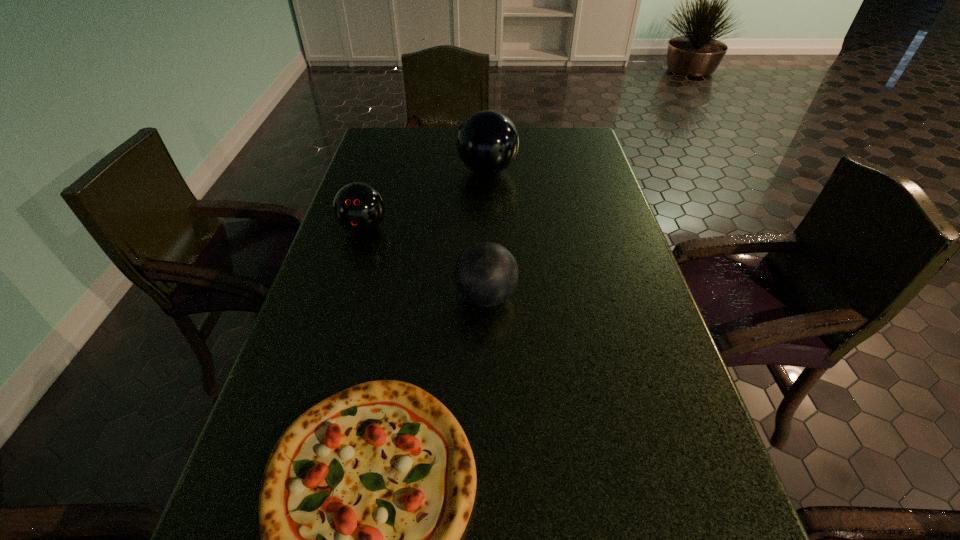
Find the location of a particular element. This screenshot has width=960, height=540. vacant area that lies between the second nearest object and the leftmost bowling ball is located at coordinates (425, 262).

Where is `free space between the third farthest object and the farthest object`? The width and height of the screenshot is (960, 540). free space between the third farthest object and the farthest object is located at coordinates (487, 234).

The image size is (960, 540). Identify the location of object that stands as the second closest to the nearest bowling ball. (358, 207).

I want to click on object that is the third closest to the second nearest object, so [x=487, y=143].

Locate which bowling ball is the second closest to the third farthest object. Please provide its 2D coordinates. Your answer should be formatted as a tuple, i.e. [(x, y)], where the tuple contains the x and y coordinates of a point satisfying the conditions above.

[(487, 143)]

Where is `bowling ball identified as the second closest to the leftmost bowling ball`? bowling ball identified as the second closest to the leftmost bowling ball is located at coordinates (486, 274).

I want to click on vacant space that satisfies the following two spatial constraints: 1. on the side of the tallest object with the finger holes; 2. on the surface of the leftmost bowling ball near the finger holes, so click(489, 228).